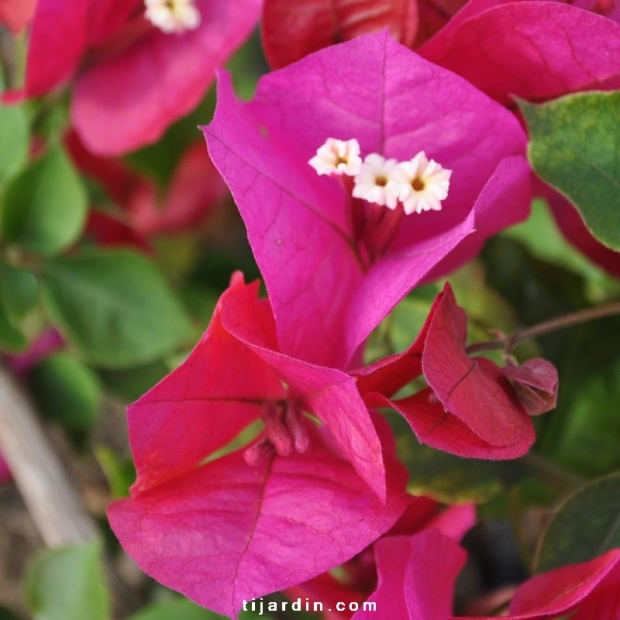
What are the coordinates of `middle flower` in the screenshot? It's located at (345, 228).